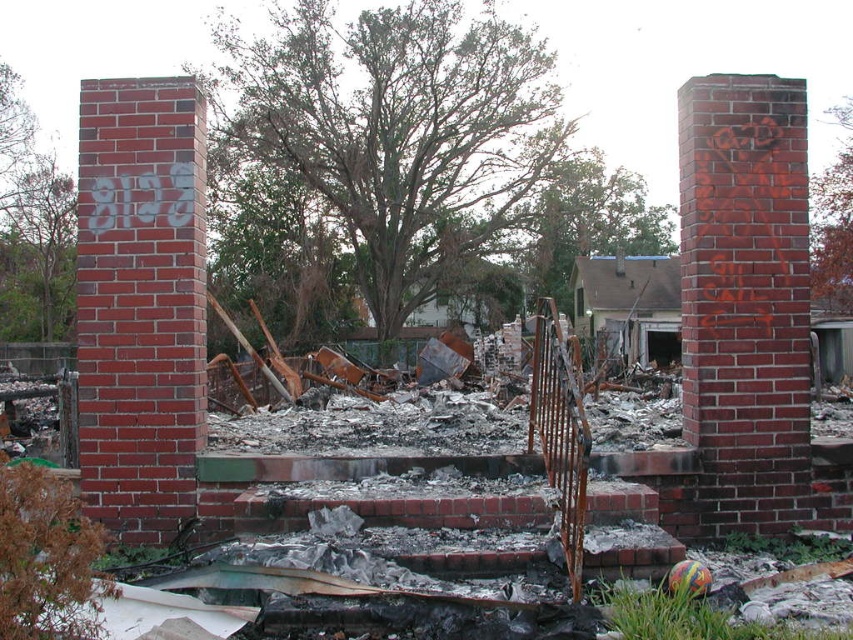
Between red brick chimney at center and red brick chimney at left, which one is positioned lower?

red brick chimney at center

Find the location of a particular element. The image size is (853, 640). red brick chimney at center is located at coordinates (746, 300).